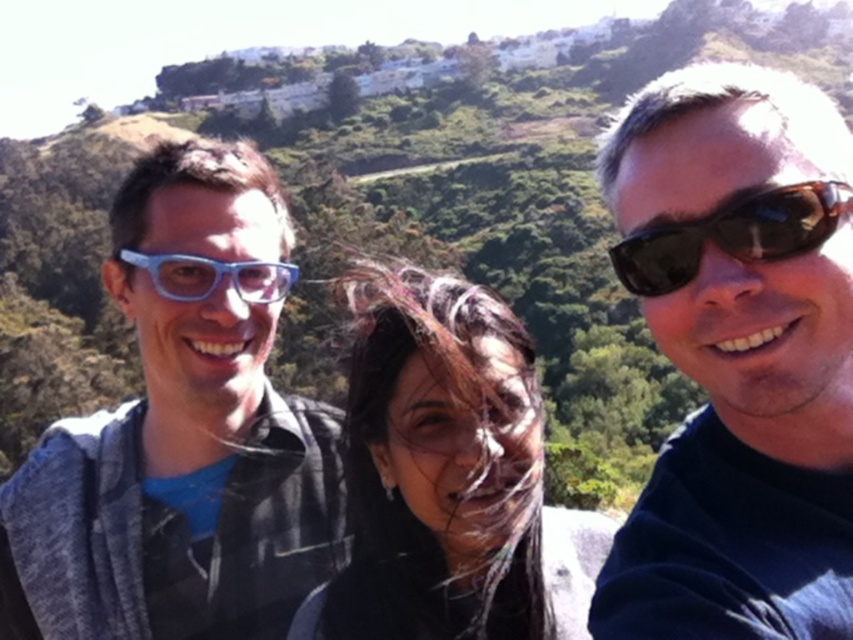
You are trying to decide which pair of glasses to wear for a hike. You have the matte blue glasses at left and the blue plastic glasses at left with you. If you want to choose the wider pair, which one should you pick?

The matte blue glasses at left might be wider than blue plastic glasses at left, so you should pick the matte blue glasses at left if you want the wider pair.

You are trying to take a photo of the two pairs of sunglasses in the scene. The black plastic sunglasses at upper right and the brown textured sunglasses at right are both in your camera frame. Which pair is positioned more to the left side of the frame?

The black plastic sunglasses at upper right is positioned more to the left side of the frame than the brown textured sunglasses at right.

You are a photographer trying to capture the two pairs of glasses worn by the people on the left. Which pair of glasses, the matte blue glasses at left or the blue plastic glasses at left, is positioned higher on the person?

The matte blue glasses at left is taller than the blue plastic glasses at left, so the matte blue glasses at left is positioned higher on the person.